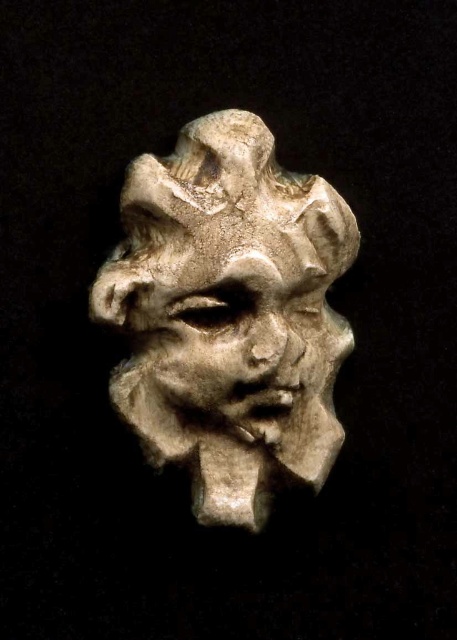
In the scene shown: You are an art conservator examining the matte stone sculpture at center. Based on its current position, what are the coordinates of its center?

The coordinates of the center of the matte stone sculpture at center are at point (228, 316).

You are an art conservator examining the matte stone sculpture at center and the matte stone face at center. Based on their spatial relationship, which one do you think has a greater width?

The matte stone sculpture at center might be wider than matte stone face at center according to the description.

You are an art conservator examining the sculpture. You notice two parts of the sculpture labeled as the matte stone sculpture at center and the matte stone face at center. Which part is positioned higher in the artwork?

The matte stone sculpture at center is located above the matte stone face at center, so the matte stone sculpture at center is positioned higher in the artwork.